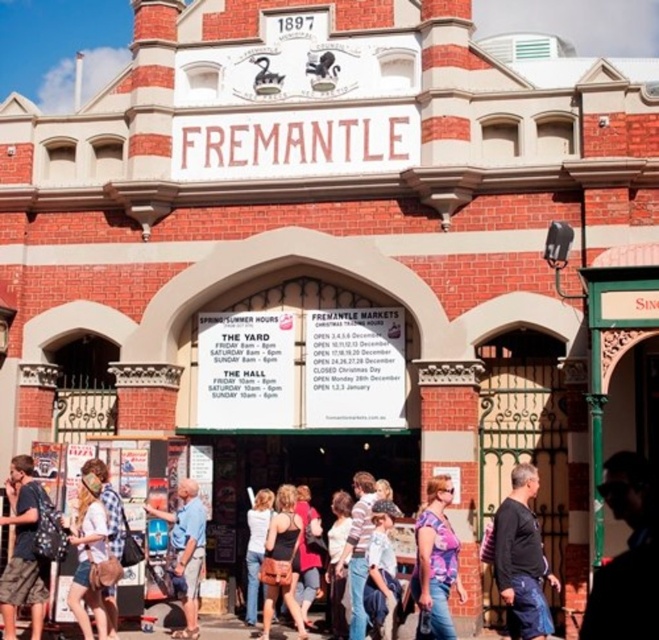
Question: Is denim shorts at lower left below white cotton shirt at center?

Choices:
 (A) yes
 (B) no

Answer: (B)

Question: Can you confirm if floral fabric blouse at center is wider than blue shirt at center?

Choices:
 (A) yes
 (B) no

Answer: (B)

Question: Which of the following is the closest to the observer?

Choices:
 (A) black cotton shirt at right
 (B) dark blue shirt at lower right
 (C) denim shorts at lower left
 (D) plaid shirt at center

Answer: (A)

Question: Which of the following is the closest to the observer?

Choices:
 (A) (287, 596)
 (B) (639, 460)
 (C) (103, 596)

Answer: (C)

Question: Estimate the real-world distances between objects in this image. Which object is farther from the denim jacket at center?

Choices:
 (A) matte black tank top at center
 (B) black cotton shirt at right

Answer: (B)

Question: Does denim shorts at lower left have a larger size compared to denim jacket at center?

Choices:
 (A) no
 (B) yes

Answer: (A)